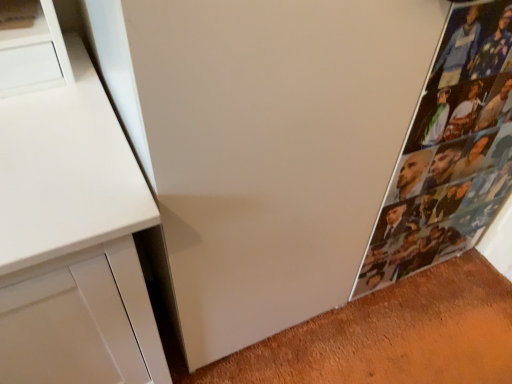
What are the coordinates of `vacant area that lies to the right of printed paper collage at right` in the screenshot? It's located at (468, 291).